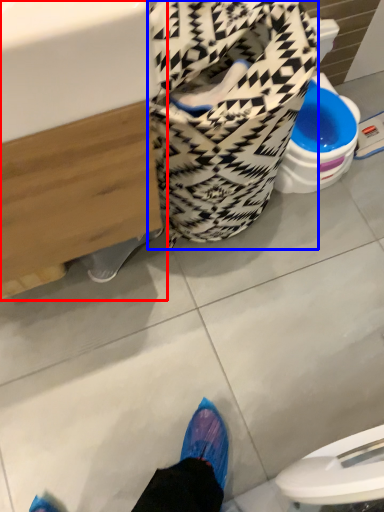
Question: Which object is further to the camera taking this photo, sink (highlighted by a red box) or laundry basket (highlighted by a blue box)?

Choices:
 (A) sink
 (B) laundry basket

Answer: (B)